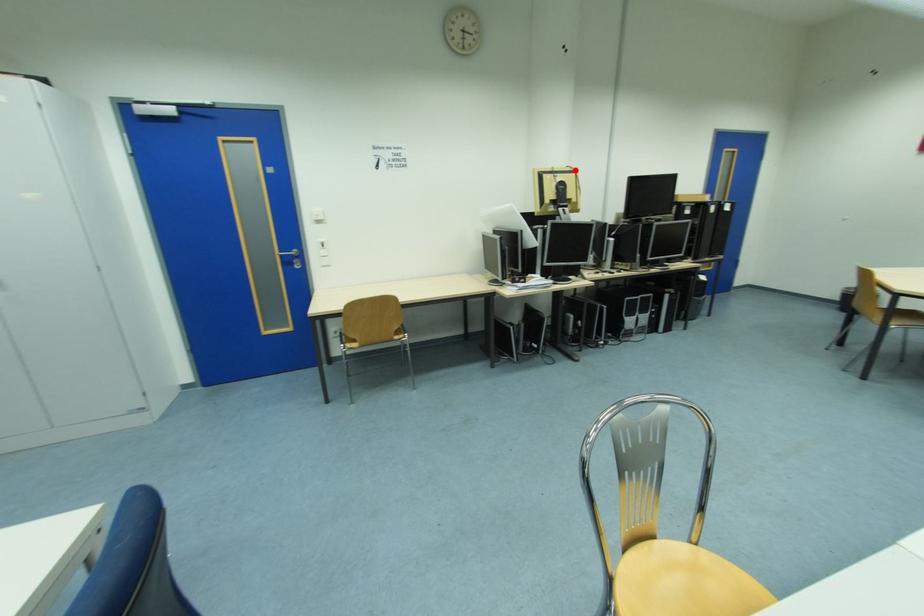
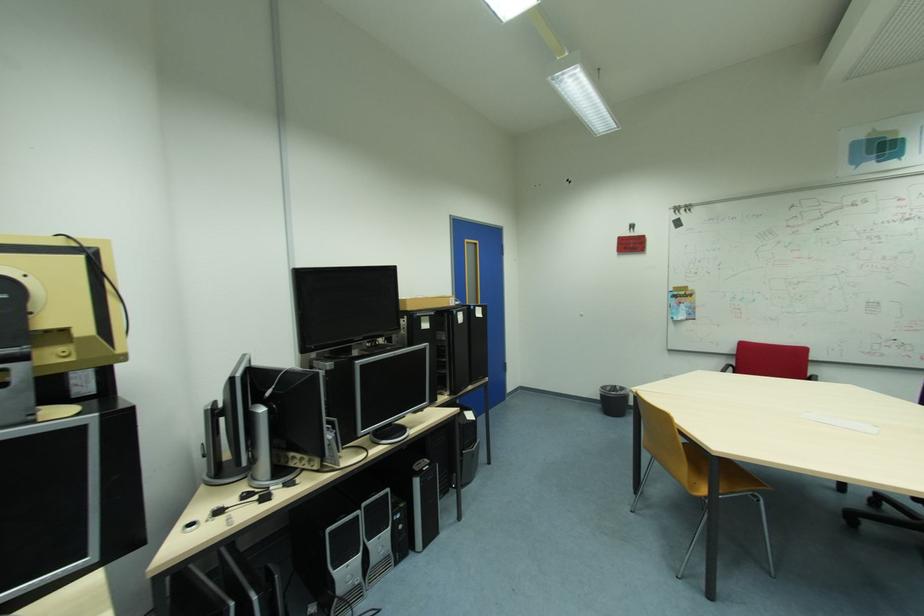
Find the pixel in the second image that matches the highlighted location in the first image.

(66, 244)